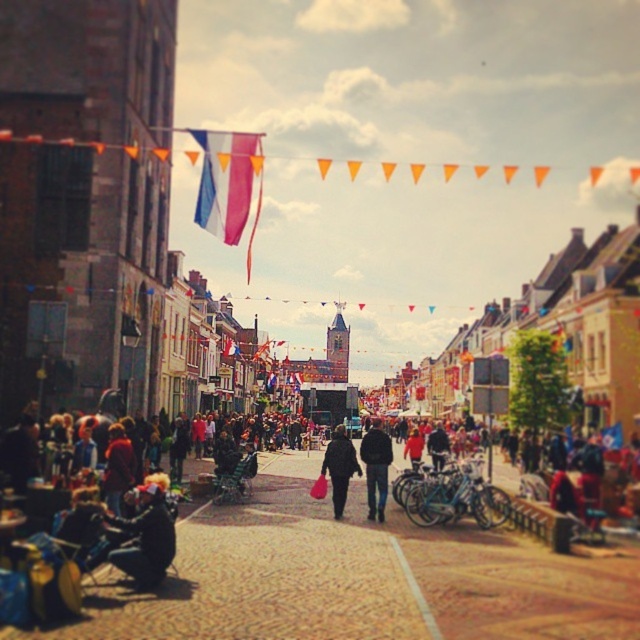
You are a photographer standing at the end of the street. You want to take a photo that includes both the dark blue jeans at center and the matte black jacket at center. Which object will appear larger in your photo?

The dark blue jeans at center will appear larger in the photo because it is closer to the viewer than the matte black jacket at center.

Looking at this image, you are a photographer standing at the end of the street. You want to capture both the blue and white fabric flag at upper center and the dark blue jeans at center in your photo. Which object should you focus on first to ensure both are in the frame?

The blue and white fabric flag at upper center is larger than the dark blue jeans at center, so you should focus on the flag first to ensure both fit within the frame.

You are standing at the center of the street in this lively European town scene. You notice two points marked on the ground ahead of you. The first is at coordinates point (362, 456) and the second is at point (419, 433). Which point is closer to you?

Point (362, 456) is closer to the viewer than point (419, 433).